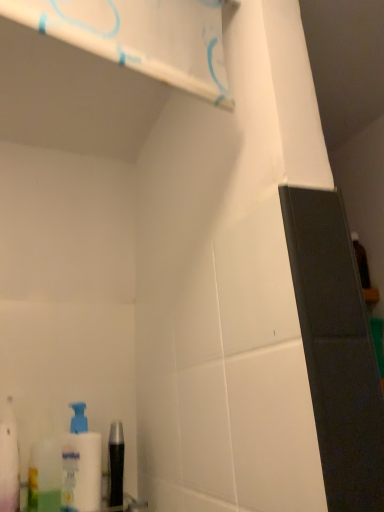
The height and width of the screenshot is (512, 384). What do you see at coordinates (115, 464) in the screenshot?
I see `black glossy mouthwash at lower left, positioned as the first mouthwash in right-to-left order` at bounding box center [115, 464].

The image size is (384, 512). What are the coordinates of `white plastic pump bottle at lower left` in the screenshot? It's located at (81, 465).

What do you see at coordinates (9, 462) in the screenshot? I see `white plastic bottle at lower left` at bounding box center [9, 462].

What do you see at coordinates (141, 37) in the screenshot? The height and width of the screenshot is (512, 384). I see `white glossy shelf at upper center` at bounding box center [141, 37].

Where is `white glossy shelf at upper center`? This screenshot has width=384, height=512. white glossy shelf at upper center is located at coordinates (141, 37).

The image size is (384, 512). Identify the location of translucent plastic mouthwash at lower left, acting as the 1th mouthwash starting from the left. pos(44,476).

Between black glossy mouthwash at lower left, the 2th mouthwash in the left-to-right sequence, and white plastic pump bottle at lower left, which one has smaller width?

With smaller width is black glossy mouthwash at lower left, the 2th mouthwash in the left-to-right sequence.

Measure the distance between black glossy mouthwash at lower left, the 2th mouthwash in the left-to-right sequence, and white plastic pump bottle at lower left.

The distance of black glossy mouthwash at lower left, the 2th mouthwash in the left-to-right sequence, from white plastic pump bottle at lower left is 2.74 inches.

Considering the positions of point (117, 470) and point (81, 509), is point (117, 470) closer or farther from the camera than point (81, 509)?

Point (117, 470).

Looking at this image, is white plastic pump bottle at lower left at the back of black glossy mouthwash at lower left, the 2th mouthwash in the left-to-right sequence?

black glossy mouthwash at lower left, the 2th mouthwash in the left-to-right sequence, is not turned away from white plastic pump bottle at lower left.

Locate an element on the screen. Image resolution: width=384 pixels, height=512 pixels. shelf located above the white plastic pump bottle at lower left (from a real-world perspective) is located at coordinates (141, 37).

Is white plastic pump bottle at lower left completely or partially inside white glossy shelf at upper center?

Definitely not — white plastic pump bottle at lower left is not inside white glossy shelf at upper center.

From a real-world perspective, who is located higher, white glossy shelf at upper center or white plastic pump bottle at lower left?

white glossy shelf at upper center, from a real-world perspective.

Does translucent plastic mouthwash at lower left, the 2th mouthwash viewed from the right, appear on the right side of white plastic pump bottle at lower left?

In fact, translucent plastic mouthwash at lower left, the 2th mouthwash viewed from the right, is to the left of white plastic pump bottle at lower left.

How different are the orientations of translucent plastic mouthwash at lower left, acting as the 1th mouthwash starting from the left, and white plastic pump bottle at lower left in degrees?

The facing directions of translucent plastic mouthwash at lower left, acting as the 1th mouthwash starting from the left, and white plastic pump bottle at lower left are 0.00162 degrees apart.

Between point (30, 507) and point (72, 446), which one is positioned behind?

The point (72, 446) is farther from the camera.

Which of these two, translucent plastic mouthwash at lower left, acting as the 1th mouthwash starting from the left, or white plastic pump bottle at lower left, is thinner?

With smaller width is white plastic pump bottle at lower left.

Is white plastic pump bottle at lower left looking in the opposite direction of white plastic bottle at lower left?

white plastic pump bottle at lower left does not have its back to white plastic bottle at lower left.

Is white plastic pump bottle at lower left directly adjacent to white plastic bottle at lower left?

No, white plastic pump bottle at lower left is not making contact with white plastic bottle at lower left.

Could white plastic bottle at lower left be considered to be inside white plastic pump bottle at lower left?

No, white plastic bottle at lower left is located outside of white plastic pump bottle at lower left.

How much distance is there between white plastic pump bottle at lower left and white plastic bottle at lower left?

The distance of white plastic pump bottle at lower left from white plastic bottle at lower left is 4.70 inches.

Is black glossy mouthwash at lower left, positioned as the first mouthwash in right-to-left order, placed right next to white glossy shelf at upper center?

No, black glossy mouthwash at lower left, positioned as the first mouthwash in right-to-left order, is not making contact with white glossy shelf at upper center.

Considering the relative sizes of black glossy mouthwash at lower left, the 2th mouthwash in the left-to-right sequence, and white glossy shelf at upper center in the image provided, is black glossy mouthwash at lower left, the 2th mouthwash in the left-to-right sequence, bigger than white glossy shelf at upper center?

Incorrect, black glossy mouthwash at lower left, the 2th mouthwash in the left-to-right sequence, is not larger than white glossy shelf at upper center.

Consider the image. Is black glossy mouthwash at lower left, positioned as the first mouthwash in right-to-left order, thinner than white glossy shelf at upper center?

Incorrect, the width of black glossy mouthwash at lower left, positioned as the first mouthwash in right-to-left order, is not less than that of white glossy shelf at upper center.

From the image's perspective, between black glossy mouthwash at lower left, the 2th mouthwash in the left-to-right sequence, and white glossy shelf at upper center, who is located below?

From the image's view, black glossy mouthwash at lower left, the 2th mouthwash in the left-to-right sequence, is below.

Between point (109, 488) and point (49, 481), which one is positioned behind?

The point (109, 488) is behind.

Could you tell me if black glossy mouthwash at lower left, positioned as the first mouthwash in right-to-left order, is facing translucent plastic mouthwash at lower left, acting as the 1th mouthwash starting from the left?

No, black glossy mouthwash at lower left, positioned as the first mouthwash in right-to-left order, is not turned towards translucent plastic mouthwash at lower left, acting as the 1th mouthwash starting from the left.

Which of these two, black glossy mouthwash at lower left, the 2th mouthwash in the left-to-right sequence, or translucent plastic mouthwash at lower left, the 2th mouthwash viewed from the right, is wider?

With larger width is translucent plastic mouthwash at lower left, the 2th mouthwash viewed from the right.

Is point (1, 440) positioned after point (50, 440)?

No.

Is white plastic bottle at lower left to the right of translucent plastic mouthwash at lower left, acting as the 1th mouthwash starting from the left, from the viewer's perspective?

Incorrect, white plastic bottle at lower left is not on the right side of translucent plastic mouthwash at lower left, acting as the 1th mouthwash starting from the left.

Does white plastic bottle at lower left have a lesser height compared to translucent plastic mouthwash at lower left, acting as the 1th mouthwash starting from the left?

No, white plastic bottle at lower left is not shorter than translucent plastic mouthwash at lower left, acting as the 1th mouthwash starting from the left.

Considering the relative sizes of white plastic bottle at lower left and translucent plastic mouthwash at lower left, acting as the 1th mouthwash starting from the left, in the image provided, is white plastic bottle at lower left smaller than translucent plastic mouthwash at lower left, acting as the 1th mouthwash starting from the left,?

No.

Where is `cleaning product in front of the black glossy mouthwash at lower left, the 2th mouthwash in the left-to-right sequence`? The width and height of the screenshot is (384, 512). cleaning product in front of the black glossy mouthwash at lower left, the 2th mouthwash in the left-to-right sequence is located at coordinates (81, 465).

Where is `cleaning product located below the white glossy shelf at upper center (from the image's perspective)`? cleaning product located below the white glossy shelf at upper center (from the image's perspective) is located at coordinates (81, 465).

From the image, which object appears to be farther from translucent plastic mouthwash at lower left, acting as the 1th mouthwash starting from the left, white glossy shelf at upper center or white plastic pump bottle at lower left?

white glossy shelf at upper center.

Considering their positions, is white plastic pump bottle at lower left positioned closer to translucent plastic mouthwash at lower left, acting as the 1th mouthwash starting from the left, than white plastic bottle at lower left?

white plastic pump bottle at lower left is closer to translucent plastic mouthwash at lower left, acting as the 1th mouthwash starting from the left.

Based on their spatial positions, is white plastic bottle at lower left or white glossy shelf at upper center closer to white plastic pump bottle at lower left?

white plastic bottle at lower left.

From the image, which object appears to be farther from translucent plastic mouthwash at lower left, acting as the 1th mouthwash starting from the left, white plastic pump bottle at lower left or white glossy shelf at upper center?

The object further to translucent plastic mouthwash at lower left, acting as the 1th mouthwash starting from the left, is white glossy shelf at upper center.

Estimate the real-world distances between objects in this image. Which object is closer to white plastic bottle at lower left, white plastic pump bottle at lower left or white glossy shelf at upper center?

white plastic pump bottle at lower left lies closer to white plastic bottle at lower left than the other object.

Looking at the image, which one is located further to translucent plastic mouthwash at lower left, the 2th mouthwash viewed from the right, white glossy shelf at upper center or white plastic bottle at lower left?

The object further to translucent plastic mouthwash at lower left, the 2th mouthwash viewed from the right, is white glossy shelf at upper center.

Considering their positions, is black glossy mouthwash at lower left, positioned as the first mouthwash in right-to-left order, positioned further to white plastic pump bottle at lower left than white glossy shelf at upper center?

The object further to white plastic pump bottle at lower left is white glossy shelf at upper center.

Which object lies nearer to the anchor point white glossy shelf at upper center, translucent plastic mouthwash at lower left, the 2th mouthwash viewed from the right, or white plastic pump bottle at lower left?

white plastic pump bottle at lower left.

Locate an element on the screen. The image size is (384, 512). cleaning product between white glossy shelf at upper center and black glossy mouthwash at lower left, positioned as the first mouthwash in right-to-left order, in the vertical direction is located at coordinates (81, 465).

Where is `mouthwash between white plastic bottle at lower left and white plastic pump bottle at lower left from left to right`? mouthwash between white plastic bottle at lower left and white plastic pump bottle at lower left from left to right is located at coordinates (44, 476).

Identify the location of toiletry that lies between white glossy shelf at upper center and black glossy mouthwash at lower left, the 2th mouthwash in the left-to-right sequence, from top to bottom. tap(9, 462).

I want to click on toiletry between white glossy shelf at upper center and translucent plastic mouthwash at lower left, acting as the 1th mouthwash starting from the left, in the vertical direction, so click(9, 462).